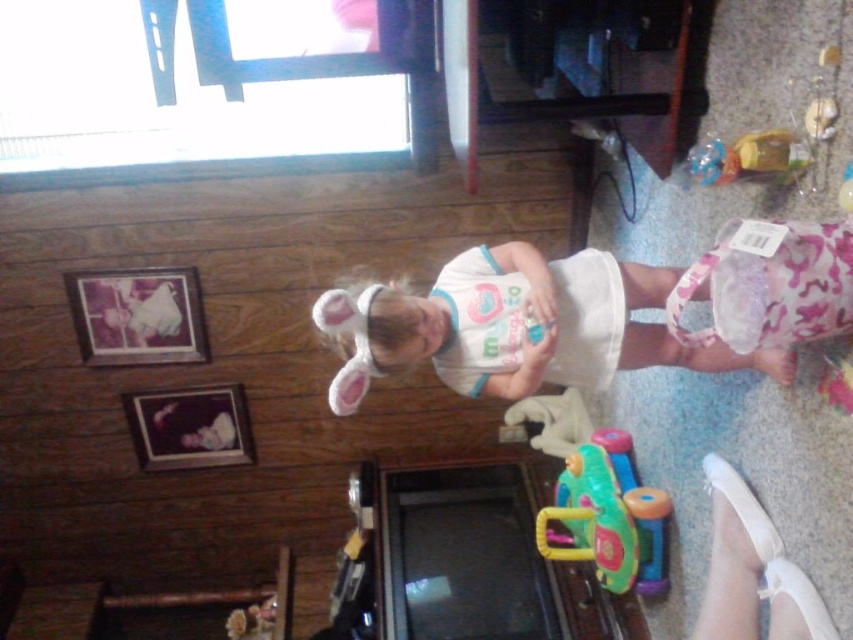
Who is lower down, white fabric dress at center or rubberized plastic toy car at lower center?

rubberized plastic toy car at lower center is lower down.

Between point (403, 352) and point (637, 522), which one is positioned in front?

Positioned in front is point (403, 352).

Identify the location of white fabric dress at center. Image resolution: width=853 pixels, height=640 pixels. (517, 326).